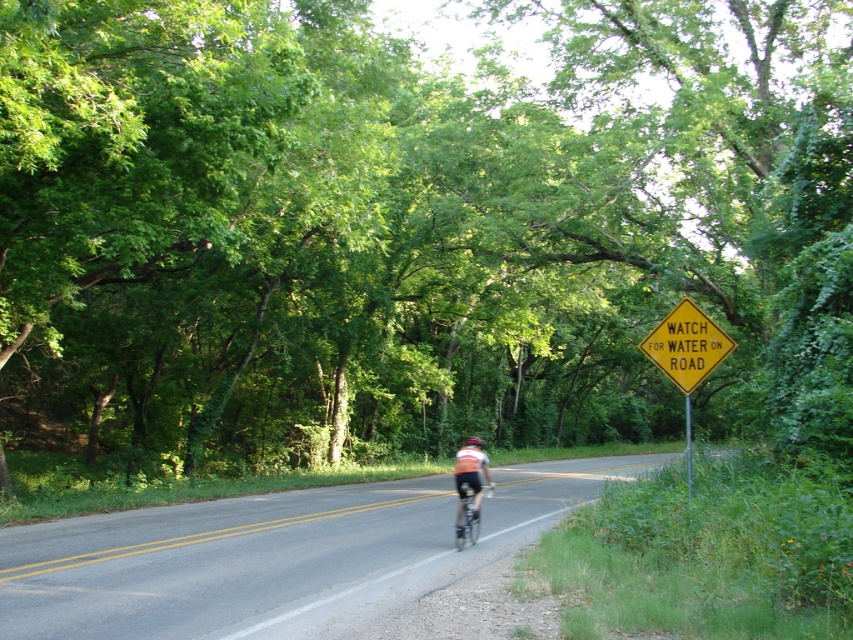
Question: Which point is closer to the camera?

Choices:
 (A) (704, 369)
 (B) (469, 529)

Answer: (A)

Question: Which object is positioned closest to the orange fabric cyclist at center?

Choices:
 (A) metallic silver bicycle at center
 (B) yellow diamond-shaped sign at upper right

Answer: (A)

Question: Which point is farther from the camera taking this photo?

Choices:
 (A) (463, 440)
 (B) (672, 381)
 (C) (457, 506)
 (D) (662, 324)

Answer: (A)

Question: In this image, where is yellow diamond-shaped sign at upper right located relative to black matte bicycle helmet at center?

Choices:
 (A) below
 (B) above

Answer: (B)

Question: Does yellow diamond-shaped sign at right have a smaller size compared to orange fabric cyclist at center?

Choices:
 (A) yes
 (B) no

Answer: (B)

Question: Is yellow diamond-shaped sign at upper right in front of black matte bicycle helmet at center?

Choices:
 (A) no
 (B) yes

Answer: (B)